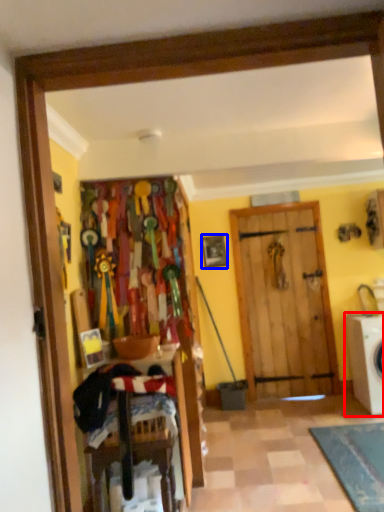
Question: Which object is further to the camera taking this photo, washing machine (highlighted by a red box) or picture frame (highlighted by a blue box)?

Choices:
 (A) washing machine
 (B) picture frame

Answer: (B)